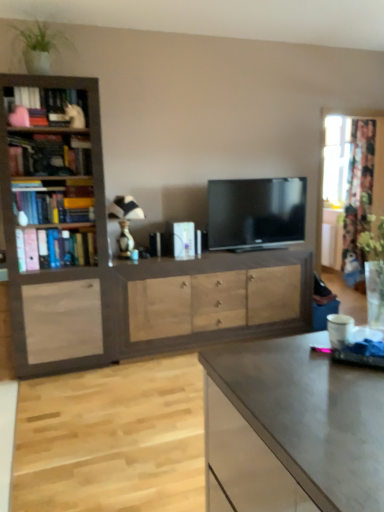
This screenshot has height=512, width=384. Identify the location of free space in front of light wood drawer at center. (136, 408).